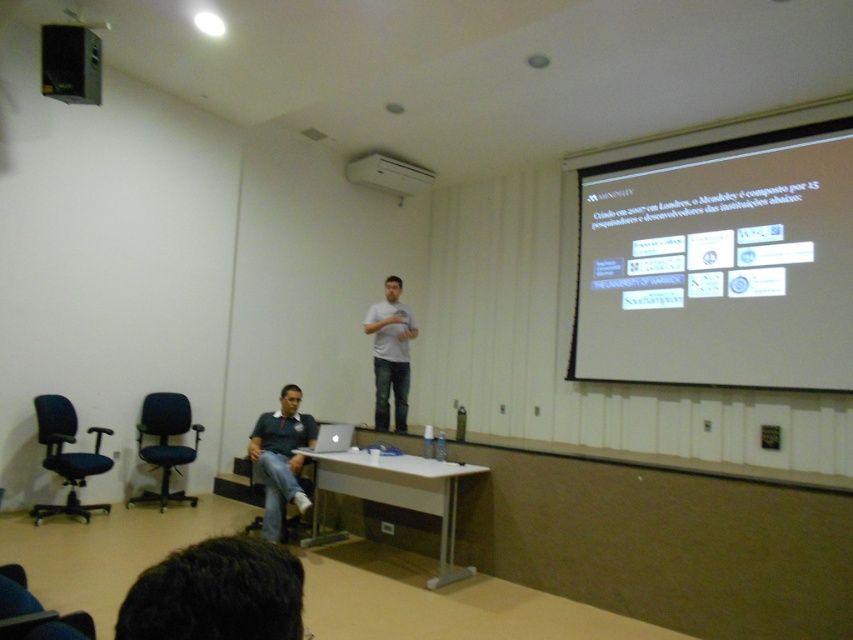
Is black mesh office chair at left above white plastic projector at upper center?

No, black mesh office chair at left is not above white plastic projector at upper center.

Which is behind, point (57, 436) or point (405, 193)?

Positioned behind is point (405, 193).

Where is `black mesh office chair at left`? black mesh office chair at left is located at coordinates (67, 456).

Is point (33, 508) in front of point (347, 435)?

That is True.

Is point (49, 468) positioned behind point (337, 435)?

Yes, point (49, 468) is farther from viewer.

Describe the element at coordinates (67, 456) in the screenshot. I see `black mesh office chair at left` at that location.

Where is `black mesh office chair at left`? black mesh office chair at left is located at coordinates (67, 456).

Which is above, green fabric shirt at lower left or silver metallic laptop at lower center?

silver metallic laptop at lower center is higher up.

Which is behind, point (286, 448) or point (325, 429)?

The point (286, 448) is behind.

Where is `green fabric shirt at lower left`? The image size is (853, 640). green fabric shirt at lower left is located at coordinates (280, 458).